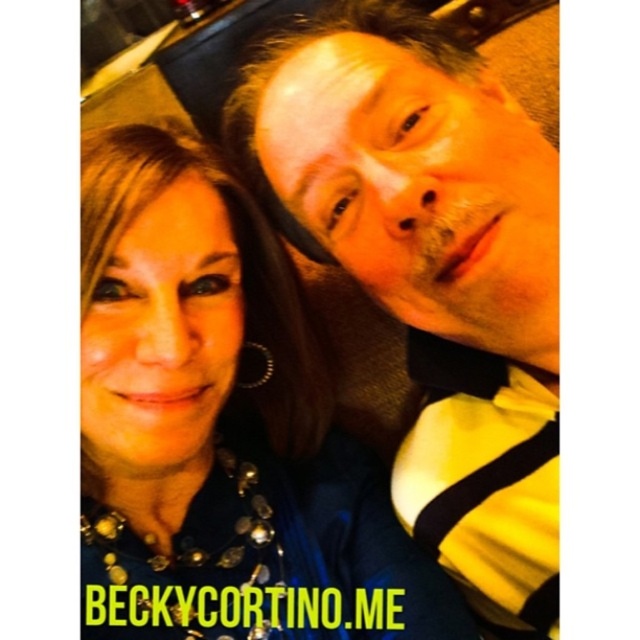
Question: Which point is farther to the camera?

Choices:
 (A) yellow striped shirt at upper right
 (B) blue fabric at center

Answer: (B)

Question: Which point is closer to the camera taking this photo?

Choices:
 (A) (106, 154)
 (B) (492, 268)

Answer: (B)

Question: Does blue fabric at center appear on the right side of yellow striped shirt at upper right?

Choices:
 (A) no
 (B) yes

Answer: (A)

Question: Which point is farther to the camera?

Choices:
 (A) blue fabric at center
 (B) yellow striped shirt at upper right

Answer: (A)

Question: Is blue fabric at center smaller than yellow striped shirt at upper right?

Choices:
 (A) yes
 (B) no

Answer: (A)

Question: Is blue fabric at center above yellow striped shirt at upper right?

Choices:
 (A) no
 (B) yes

Answer: (A)